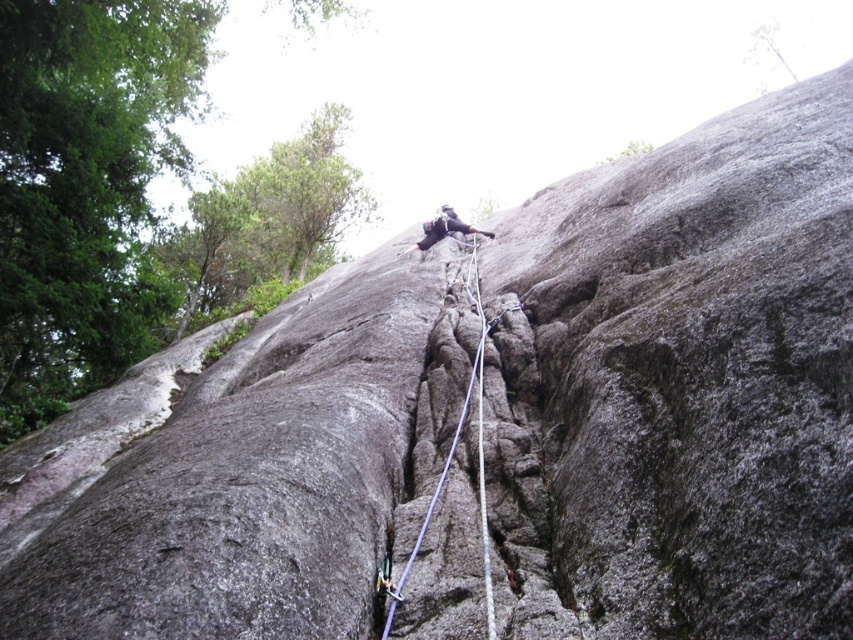
Based on the photo, who is higher up, purple nylon rope at center or dark gray climbing gear at center?

dark gray climbing gear at center is above.

Looking at this image, who is taller, purple nylon rope at center or dark gray climbing gear at center?

purple nylon rope at center

Does point (482, 528) lie behind point (454, 220)?

That is False.

The image size is (853, 640). I want to click on purple nylon rope at center, so click(x=451, y=452).